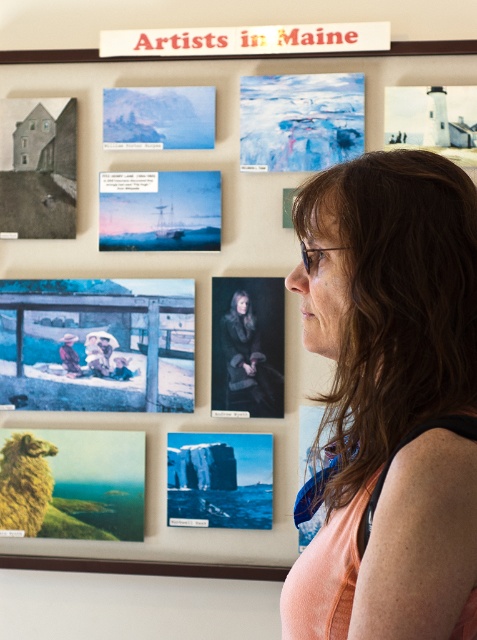
Question: Which of the following is the closest to the observer?

Choices:
 (A) blue matte painting at center
 (B) blue faded photo at lower left
 (C) dark matte portrait at center

Answer: (C)

Question: Is blue faded photo at lower left smaller than dark matte portrait at center?

Choices:
 (A) no
 (B) yes

Answer: (A)

Question: Which point is farther to the camera?

Choices:
 (A) (344, 106)
 (B) (270, 464)
 (C) (350, 38)

Answer: (B)

Question: Is blue ice sculpture at upper center positioned in front of matte paper house at left?

Choices:
 (A) no
 (B) yes

Answer: (B)

Question: Which of the following is the closest to the observer?

Choices:
 (A) (413, 260)
 (B) (255, 51)
 (C) (203, 468)
 (D) (136, 221)

Answer: (A)

Question: Does matte peach tank top at right come in front of blue faded photo at lower left?

Choices:
 (A) no
 (B) yes

Answer: (B)